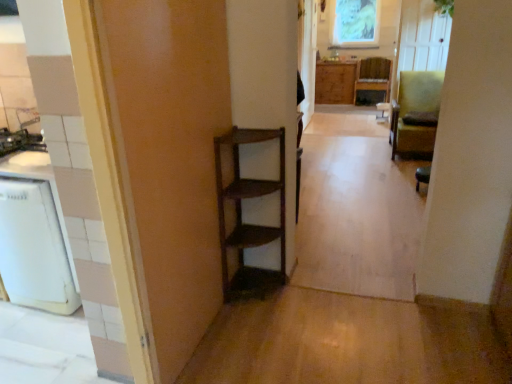
Identify the location of wooden chair at center, acting as the first chair starting from the back. [x=372, y=79].

The image size is (512, 384). I want to click on wooden shelf at center, so click(168, 158).

Is point (364, 19) closer or farther from the camera than point (356, 84)?

Clearly, point (364, 19) is closer to the camera than point (356, 84).

How different are the orientations of green textured fabric at upper center and wooden chair at center, which appears as the 3th chair when ordered from the bottom, in degrees?

green textured fabric at upper center and wooden chair at center, which appears as the 3th chair when ordered from the bottom, are facing 4.03 degrees away from each other.

Find the location of `chair that is the 2nd object directly below the green textured fabric at upper center (from a real-world perspective)`. chair that is the 2nd object directly below the green textured fabric at upper center (from a real-world perspective) is located at coordinates (372, 79).

Considering the relative sizes of green textured fabric at upper center and wooden chair at center, the first chair positioned from the top, in the image provided, is green textured fabric at upper center wider than wooden chair at center, the first chair positioned from the top,?

Incorrect, the width of green textured fabric at upper center does not surpass that of wooden chair at center, the first chair positioned from the top.

From a real-world perspective, is wooden cabinet at center below green fabric chair at right, the 2th chair when ordered from top to bottom?

Indeed, from a real-world perspective, wooden cabinet at center is positioned beneath green fabric chair at right, the 2th chair when ordered from top to bottom.

From the image's perspective, which one is positioned lower, wooden cabinet at center or green fabric chair at right, arranged as the 2th chair when viewed from the front?

green fabric chair at right, arranged as the 2th chair when viewed from the front.

Considering the relative sizes of wooden cabinet at center and green fabric chair at right, the second chair from the back, in the image provided, is wooden cabinet at center shorter than green fabric chair at right, the second chair from the back,?

Yes, wooden cabinet at center is shorter than green fabric chair at right, the second chair from the back.

Does wooden cabinet at center have a lesser width compared to green fabric chair at right, arranged as the 2th chair when viewed from the front?

Correct, the width of wooden cabinet at center is less than that of green fabric chair at right, arranged as the 2th chair when viewed from the front.

At what (x,y) coordinates should I click in order to perform the action: click on door on the left of green fabric chair at right, which is the 1th chair in front-to-back order. Please return your answer as a coordinate pair (x, y). This screenshot has height=384, width=512. Looking at the image, I should click on [x=168, y=158].

Considering the sizes of objects green fabric chair at right, the first chair from the bottom, and wooden shelf at center in the image provided, who is smaller, green fabric chair at right, the first chair from the bottom, or wooden shelf at center?

green fabric chair at right, the first chair from the bottom, is smaller.

Could you tell me if green fabric chair at right, which is the 1th chair in front-to-back order, is facing wooden shelf at center?

No, green fabric chair at right, which is the 1th chair in front-to-back order, is not aimed at wooden shelf at center.

Measure the distance between green fabric chair at right, the third chair when ordered from back to front, and wooden shelf at center.

A distance of 9.38 feet exists between green fabric chair at right, the third chair when ordered from back to front, and wooden shelf at center.

Consider the image. Can you confirm if green fabric chair at right, the first chair from the bottom, is positioned to the left of wooden chair at center, which appears as the 3th chair when ordered from the bottom?

Indeed, green fabric chair at right, the first chair from the bottom, is positioned on the left side of wooden chair at center, which appears as the 3th chair when ordered from the bottom.

Between green fabric chair at right, the third chair in the top-to-bottom sequence, and wooden chair at center, the first chair positioned from the top, which one has more height?

Standing taller between the two is wooden chair at center, the first chair positioned from the top.

From the picture: Which of these two, green fabric chair at right, the first chair from the bottom, or wooden chair at center, which appears as the 3th chair when ordered from the bottom, is wider?

wooden chair at center, which appears as the 3th chair when ordered from the bottom.

Which is behind, point (376, 32) or point (419, 179)?

The point (376, 32) is farther.

Considering the relative positions of green textured fabric at upper center and green fabric chair at right, the third chair when ordered from back to front, in the image provided, is green textured fabric at upper center in front of green fabric chair at right, the third chair when ordered from back to front,?

No, it is behind green fabric chair at right, the third chair when ordered from back to front.

From the image's perspective, between green textured fabric at upper center and green fabric chair at right, the third chair when ordered from back to front, which one is located above?

green textured fabric at upper center is shown above in the image.

At what (x,y) coordinates should I click in order to perform the action: click on window screen that appears on the right of green fabric chair at right, which is the 1th chair in front-to-back order. Please return your answer as a coordinate pair (x, y). Looking at the image, I should click on (355, 24).

Is wooden shelf at center facing towards green textured fabric at upper center?

No, wooden shelf at center does not turn towards green textured fabric at upper center.

Which is nearer, (180,345) or (374,42)?

Point (180,345)

Considering the sizes of objects wooden shelf at center and green textured fabric at upper center in the image provided, who is taller, wooden shelf at center or green textured fabric at upper center?

wooden shelf at center is taller.

How distant is wooden shelf at center from green textured fabric at upper center?

6.60 meters.

Which of these two, wooden chair at center, the third chair from the front, or wooden shelf at center, stands shorter?

With less height is wooden chair at center, the third chair from the front.

Can you confirm if wooden chair at center, which appears as the 3th chair when ordered from the bottom, is thinner than wooden shelf at center?

No, wooden chair at center, which appears as the 3th chair when ordered from the bottom, is not thinner than wooden shelf at center.

How many degrees apart are the facing directions of wooden chair at center, acting as the first chair starting from the back, and wooden shelf at center?

92 degrees separate the facing orientations of wooden chair at center, acting as the first chair starting from the back, and wooden shelf at center.

Is wooden chair at center, the first chair positioned from the top, in contact with wooden shelf at center?

No, wooden chair at center, the first chair positioned from the top, is not in contact with wooden shelf at center.

Where is `window screen behind the wooden chair at center, acting as the first chair starting from the back`? window screen behind the wooden chair at center, acting as the first chair starting from the back is located at coordinates (355, 24).

Locate an element on the screen. This screenshot has width=512, height=384. chair that is the 2nd one when counting forward from the wooden cabinet at center is located at coordinates (416, 114).

Considering their positions, is wooden chair at center, the first chair positioned from the top, positioned closer to wooden cabinet at center than wooden shelf at center?

Based on the image, wooden chair at center, the first chair positioned from the top, appears to be nearer to wooden cabinet at center.

From the image, which object appears to be nearer to green textured fabric at upper center, wooden cabinet at center or green fabric chair at right, the second chair from the back?

wooden cabinet at center.

Looking at the image, which one is located closer to green textured fabric at upper center, green fabric chair at right, the first chair from the bottom, or green fabric chair at right, the 2th chair in the bottom-to-top sequence?

green fabric chair at right, the 2th chair in the bottom-to-top sequence, is closer to green textured fabric at upper center.

Estimate the real-world distances between objects in this image. Which object is closer to green fabric chair at right, which is the 1th chair in front-to-back order, wooden chair at center, which appears as the 3th chair when ordered from the bottom, or green fabric chair at right, the 2th chair in the bottom-to-top sequence?

green fabric chair at right, the 2th chair in the bottom-to-top sequence, is closer to green fabric chair at right, which is the 1th chair in front-to-back order.

When comparing their distances from wooden shelf at center, does green textured fabric at upper center or wooden cabinet at center seem further?

The object further to wooden shelf at center is green textured fabric at upper center.

Looking at the image, which one is located further to wooden cabinet at center, green fabric chair at right, the third chair in the top-to-bottom sequence, or wooden chair at center, the first chair positioned from the top?

The object further to wooden cabinet at center is green fabric chair at right, the third chair in the top-to-bottom sequence.

Considering their positions, is green fabric chair at right, the second chair from the back, positioned further to wooden shelf at center than green textured fabric at upper center?

Based on the image, green textured fabric at upper center appears to be further to wooden shelf at center.

Based on their spatial positions, is wooden cabinet at center or wooden shelf at center closer to green fabric chair at right, the third chair when ordered from back to front?

wooden shelf at center lies closer to green fabric chair at right, the third chair when ordered from back to front, than the other object.

Locate an element on the screen. Image resolution: width=512 pixels, height=384 pixels. window screen between wooden shelf at center and wooden cabinet at center along the z-axis is located at coordinates [x=355, y=24].

Locate an element on the screen. The image size is (512, 384). cabinetry between green textured fabric at upper center and wooden chair at center, which appears as the 3th chair when ordered from the bottom, in the vertical direction is located at coordinates (335, 82).

What are the coordinates of `chair located between green fabric chair at right, the third chair when ordered from back to front, and wooden chair at center, which appears as the 3th chair when ordered from the bottom, in the depth direction` in the screenshot? It's located at (416, 114).

Find the location of a particular element. Image resolution: width=512 pixels, height=384 pixels. chair between wooden shelf at center and green fabric chair at right, the second chair from the back, from front to back is located at coordinates (422, 176).